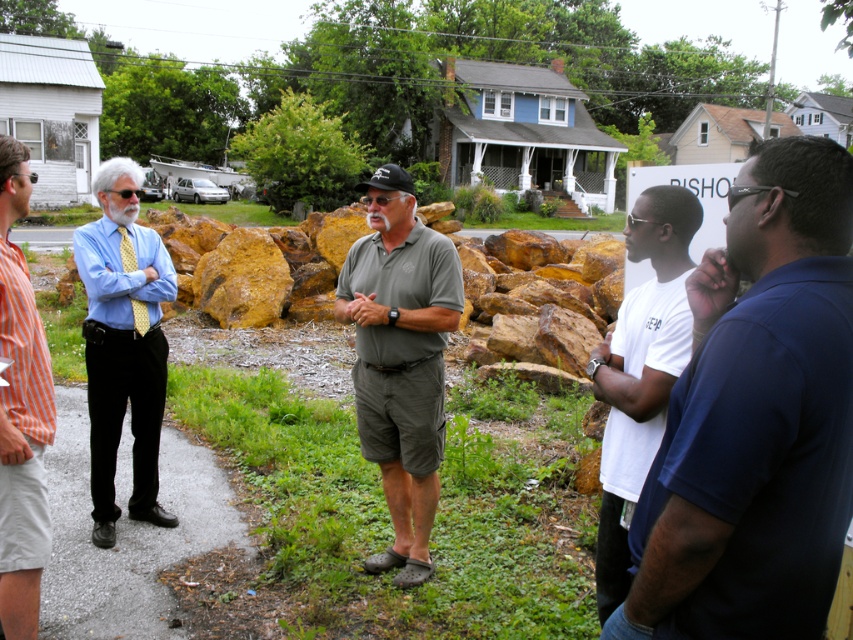
You are standing at the origin point of the coordinate system. You want to walk to the dark blue shirt at right. Which direction should you move in?

You should move in the direction of the dark blue shirt at right located at coordinate point 0.653 on the x axis and 0.887 on the y axis.

You are a delivery person trying to locate the recipient standing at the center. You see a dark green fabric shirt at center and a blue shirt at left. Which shirt is closer to the ground?

The dark green fabric shirt at center is below blue shirt at left, so it is closer to the ground.